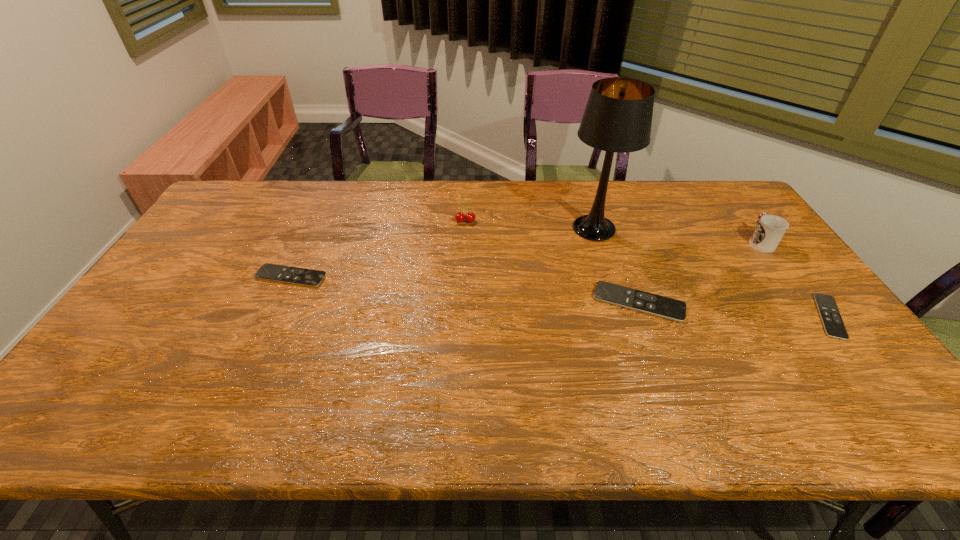
Locate an element on the screen. the second shortest object is located at coordinates (272, 272).

At what (x,y) coordinates should I click in order to perform the action: click on the leftmost object. Please return your answer as a coordinate pair (x, y). Looking at the image, I should click on (272, 272).

The height and width of the screenshot is (540, 960). Find the location of `the tallest remote control`. the tallest remote control is located at coordinates (668, 308).

Identify the location of the second remote control from right to left. This screenshot has height=540, width=960. (668, 308).

The height and width of the screenshot is (540, 960). I want to click on the shortest object, so click(834, 327).

Locate an element on the screen. Image resolution: width=960 pixels, height=540 pixels. the shortest remote control is located at coordinates (834, 327).

You are a GUI agent. You are given a task and a screenshot of the screen. Output one action in this format:
    pyautogui.click(x=<x>, y=<y>)
    Task: Click on the cup
    
    Given the screenshot: What is the action you would take?
    pyautogui.click(x=770, y=229)

Identify the location of table lamp. This screenshot has width=960, height=540. (618, 116).

Find the location of a particular element. cherry is located at coordinates (459, 217).

The height and width of the screenshot is (540, 960). I want to click on blank space located on the right of the leftmost remote control, so click(381, 276).